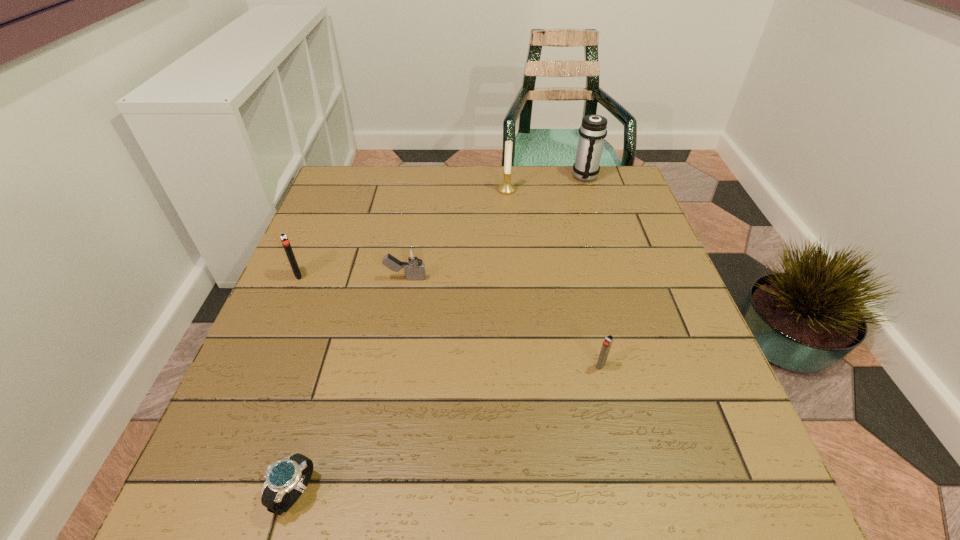
Identify which object is located as the second nearest to the rightmost object. Please provide its 2D coordinates. Your answer should be formatted as a tuple, i.e. [(x, y)], where the tuple contains the x and y coordinates of a point satisfying the conditions above.

[(413, 263)]

Identify the location of object that stands as the closest to the fifth object from right to left. The width and height of the screenshot is (960, 540). (413, 263).

The image size is (960, 540). Find the location of `the second closest igniter to the fifth object from right to left`. the second closest igniter to the fifth object from right to left is located at coordinates (283, 237).

Where is `the closest igniter to the fifth object from left to right`? The image size is (960, 540). the closest igniter to the fifth object from left to right is located at coordinates (413, 263).

At what (x,y) coordinates should I click in order to perform the action: click on free space in the image that satisfies the following two spatial constraints: 1. on the back side of the candle holder; 2. on the left side of the leftmost igniter. Please return your answer as a coordinate pair (x, y). This screenshot has height=540, width=960. Looking at the image, I should click on (334, 190).